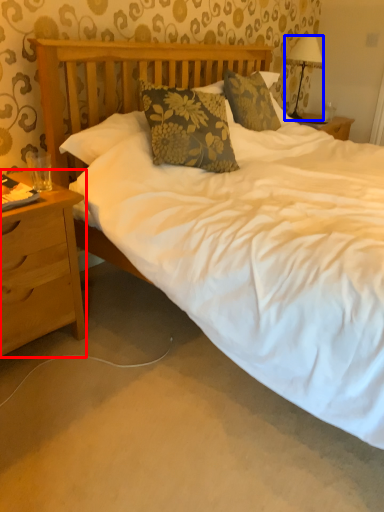
Question: Which object is further to the camera taking this photo, nightstand (highlighted by a red box) or lamp (highlighted by a blue box)?

Choices:
 (A) nightstand
 (B) lamp

Answer: (B)